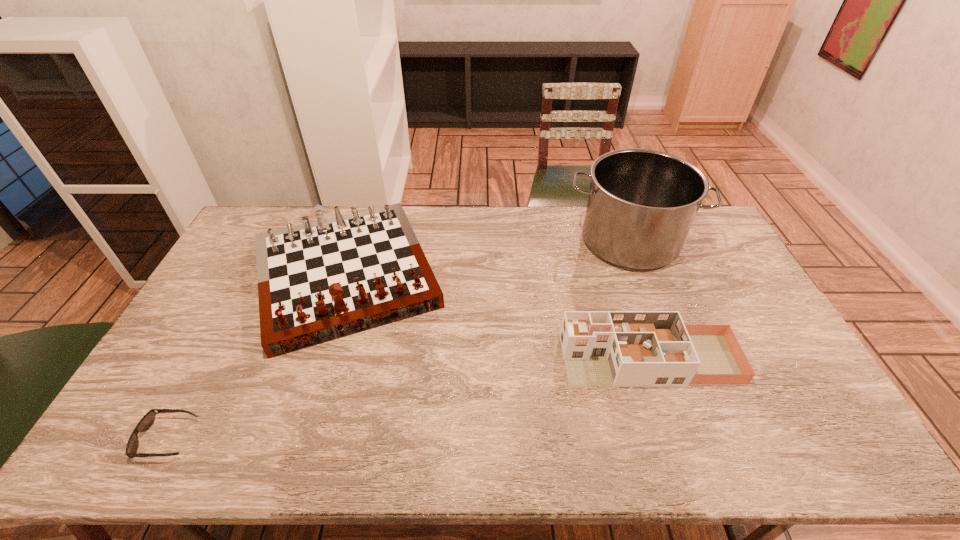
Image resolution: width=960 pixels, height=540 pixels. Find the location of `blank space located on the front-facing side of the sunglasses`. blank space located on the front-facing side of the sunglasses is located at coordinates (213, 438).

Identify the location of saucepan present at the far edge. The height and width of the screenshot is (540, 960). (642, 202).

Find the location of a particular element. gameboard at the far edge is located at coordinates (319, 281).

Where is `object located at the near edge`? This screenshot has width=960, height=540. object located at the near edge is located at coordinates (146, 422).

Where is `gameboard present at the left edge`? The image size is (960, 540). gameboard present at the left edge is located at coordinates (319, 281).

Where is `sunglasses that is at the left edge`? The image size is (960, 540). sunglasses that is at the left edge is located at coordinates [x=146, y=422].

Find the location of a particular element. object present at the right edge is located at coordinates (642, 202).

At what (x,y) coordinates should I click in order to perform the action: click on object that is positioned at the far left corner. Please return your answer as a coordinate pair (x, y). Image resolution: width=960 pixels, height=540 pixels. Looking at the image, I should click on (319, 281).

Where is `object at the near left corner`? This screenshot has width=960, height=540. object at the near left corner is located at coordinates 146,422.

Where is `object that is at the far right corner`? Image resolution: width=960 pixels, height=540 pixels. object that is at the far right corner is located at coordinates (642, 202).